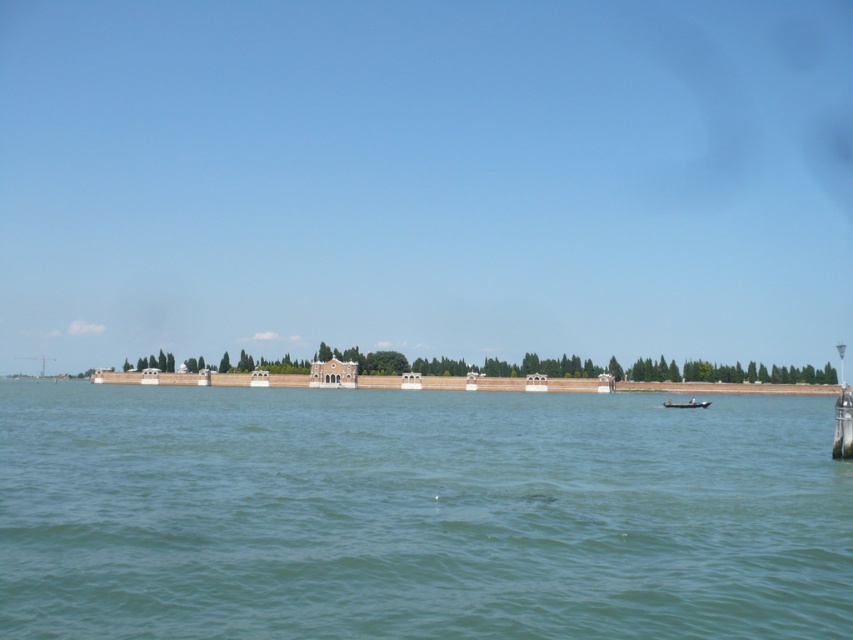
In the scene shown: Between green water at center and white stone wall at center, which one appears on the left side from the viewer's perspective?

white stone wall at center

Is point (628, 611) closer to camera compared to point (445, 388)?

Yes, it is.

This screenshot has width=853, height=640. What are the coordinates of `green water at center` in the screenshot? It's located at (416, 515).

Between green water at center and wooden boat at lower right, which one appears on the left side from the viewer's perspective?

green water at center is more to the left.

What do you see at coordinates (416, 515) in the screenshot? I see `green water at center` at bounding box center [416, 515].

You are a GUI agent. You are given a task and a screenshot of the screen. Output one action in this format:
    pyautogui.click(x=<x>, y=<y>)
    Task: Click on the green water at center
    This screenshot has width=853, height=640.
    Given the screenshot: What is the action you would take?
    pyautogui.click(x=416, y=515)

In the scene shown: Who is more distant from viewer, (729, 385) or (695, 406)?

Point (729, 385)

Describe the element at coordinates (730, 387) in the screenshot. This screenshot has height=640, width=853. I see `white stone wall at center` at that location.

Is point (720, 392) farther from viewer compared to point (666, 406)?

Yes, point (720, 392) is farther from viewer.

At what (x,y) coordinates should I click in order to perform the action: click on white stone wall at center. Please return your answer as a coordinate pair (x, y). The width and height of the screenshot is (853, 640). Looking at the image, I should click on (730, 387).